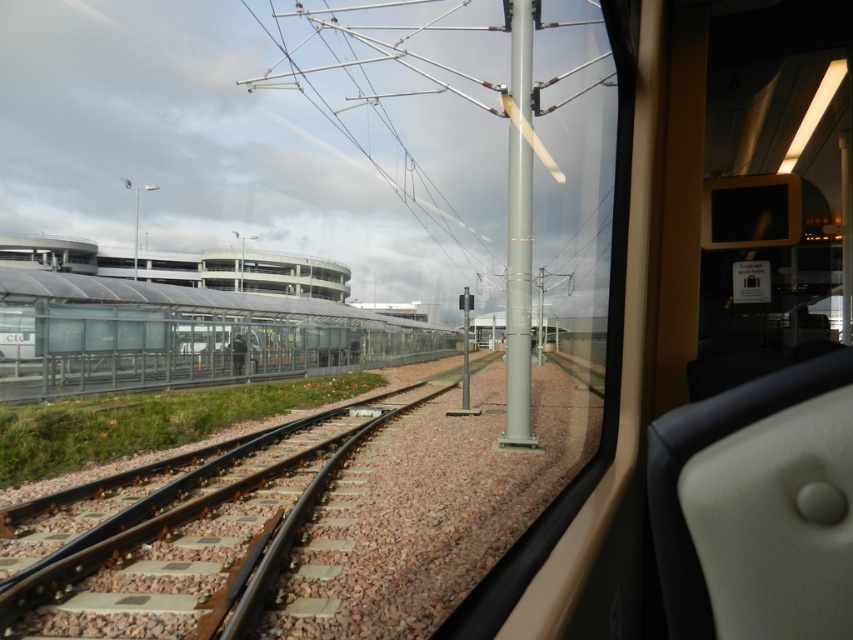
Question: Can you confirm if transparent glass train window at center is positioned above transparent glass train at left?

Choices:
 (A) yes
 (B) no

Answer: (A)

Question: Which point is closer to the camera taking this photo?

Choices:
 (A) (35, 273)
 (B) (518, 1)
 (C) (831, 298)

Answer: (C)

Question: Does transparent glass train window at center have a lesser width compared to metallic gray pole at center?

Choices:
 (A) no
 (B) yes

Answer: (A)

Question: Is transparent glass train at left to the right of metallic gray pole at center from the viewer's perspective?

Choices:
 (A) no
 (B) yes

Answer: (A)

Question: Which point is farther from the camera taking this photo?

Choices:
 (A) (520, 220)
 (B) (402, 358)

Answer: (B)

Question: Which point is closer to the camera?

Choices:
 (A) (326, 369)
 (B) (807, 17)

Answer: (B)